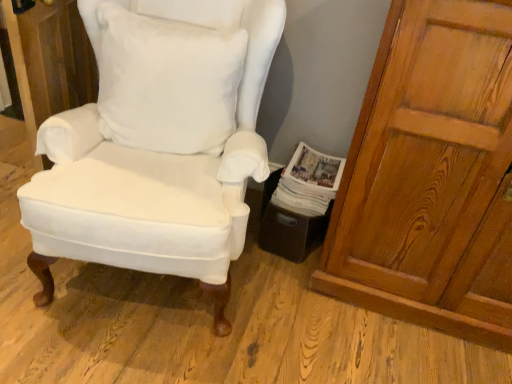
What are the coordinates of `empty space that is in between wooden door at right and matte white cushioned chair at center` in the screenshot? It's located at (335, 317).